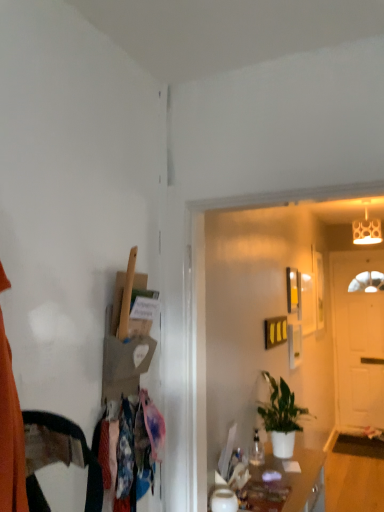
Find the location of `vacant space underneath matte white lampshade at upper right (from a real-world perspective)`. vacant space underneath matte white lampshade at upper right (from a real-world perspective) is located at coordinates (373, 483).